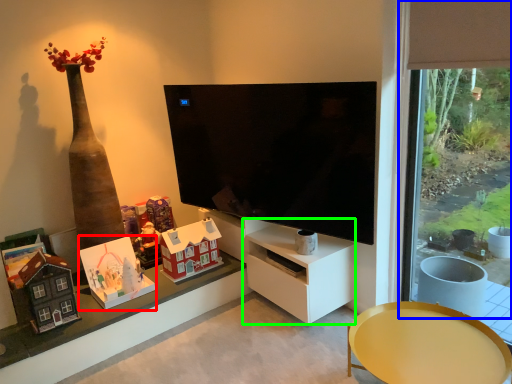
Question: Which object is the closest to the toy (highlighted by a red box)? Choose among these: window frame (highlighted by a blue box) or tv cabinet (highlighted by a green box).

Choices:
 (A) window frame
 (B) tv cabinet

Answer: (B)